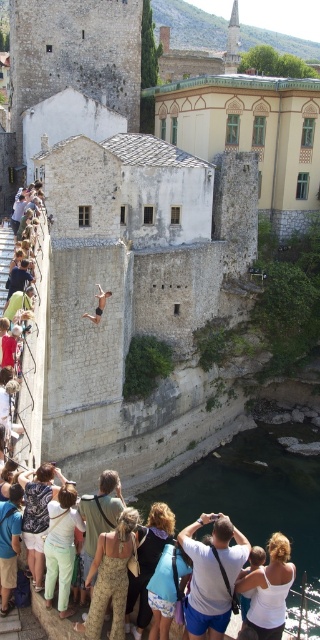
Question: Estimate the real-world distances between objects in this image. Which object is farther from the white cotton tank top at lower center?

Choices:
 (A) camouflage jumpsuit at center
 (B) green stone waterway at lower center
 (C) light green cotton pants at lower left
 (D) denim shorts at center

Answer: (A)

Question: Which point is closer to the camera taking this photo?

Choices:
 (A) (69, 508)
 (B) (142, 612)
 (C) (103, 292)

Answer: (B)

Question: Does green stone waterway at lower center lie in front of camouflage pants at center?

Choices:
 (A) yes
 (B) no

Answer: (B)

Question: Is camouflage backpack at center closer to camera compared to blue denim shorts at lower center?

Choices:
 (A) no
 (B) yes

Answer: (A)

Question: Which of these objects is positioned closest to the smooth black swimmer at center?

Choices:
 (A) denim shorts at center
 (B) white cotton tank top at lower center
 (C) light green cotton pants at lower left

Answer: (A)

Question: Does denim shorts at center come behind camouflage backpack at center?

Choices:
 (A) no
 (B) yes

Answer: (A)